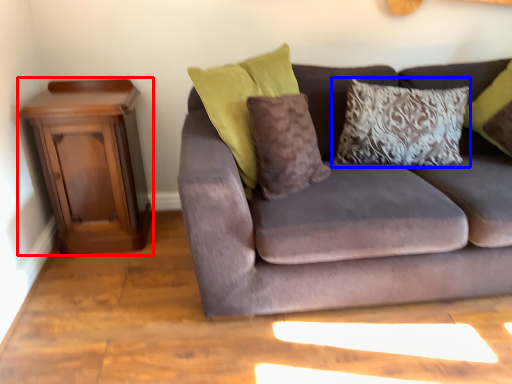
Question: Which object is further to the camera taking this photo, nightstand (highlighted by a red box) or pillow (highlighted by a blue box)?

Choices:
 (A) nightstand
 (B) pillow

Answer: (B)